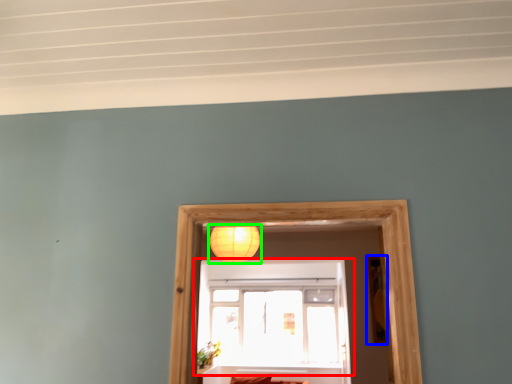
Question: Which is farther away from window (highlighted by a red box)? picture frame (highlighted by a blue box) or lamp (highlighted by a green box)?

Choices:
 (A) picture frame
 (B) lamp

Answer: (A)